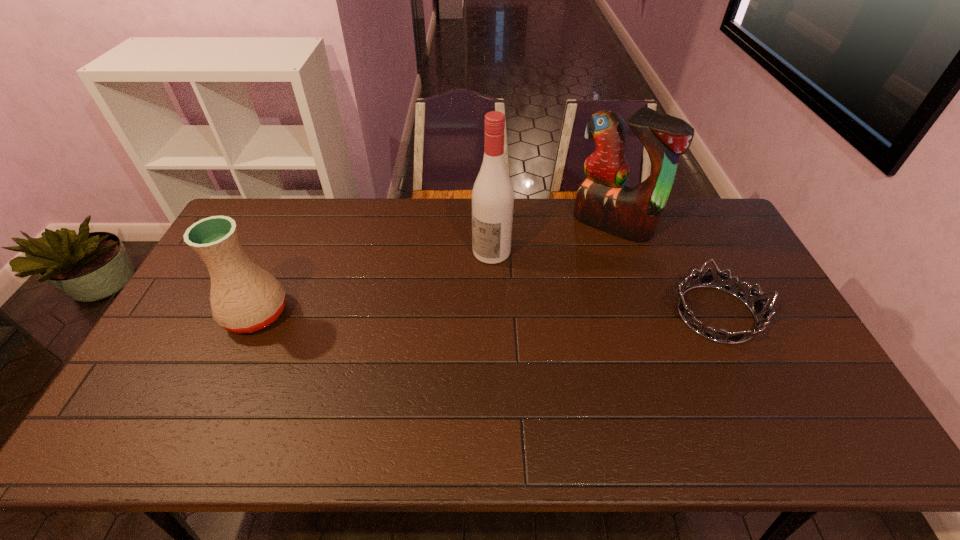
Where is `free spot located at the face of the second tallest object`? The image size is (960, 540). free spot located at the face of the second tallest object is located at coordinates (554, 287).

Find the location of a particular element. free space located at the face of the second tallest object is located at coordinates (534, 310).

I want to click on vacant space situated on the label of the second object from left to right, so click(x=409, y=349).

Identify the location of blank space located 0.350m on the label of the second object from left to right. The image size is (960, 540). (418, 339).

The image size is (960, 540). I want to click on vacant region located 0.370m on the label of the second object from left to right, so click(x=414, y=343).

This screenshot has width=960, height=540. Identify the location of parrot that is positioned at the far edge. (603, 200).

Identify the location of alcohol that is at the far edge. This screenshot has width=960, height=540. (493, 195).

This screenshot has width=960, height=540. Find the location of `object present at the left edge`. object present at the left edge is located at coordinates (244, 298).

Locate an element on the screen. The width and height of the screenshot is (960, 540). object located at the right edge is located at coordinates (707, 279).

In the image, there is a desktop. In order to click on free space at the far edge in this screenshot , I will do `click(278, 239)`.